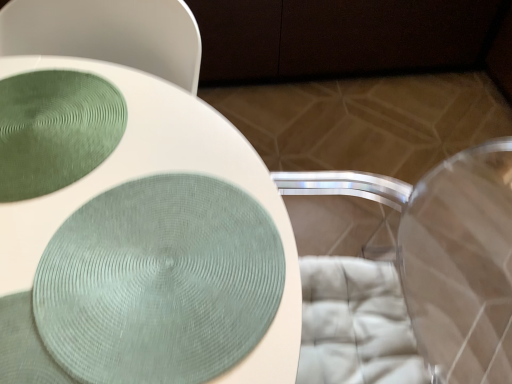
Question: Relative to transparent plastic swivel chair at lower right, is matte green fabric at center in front or behind?

Choices:
 (A) front
 (B) behind

Answer: (B)

Question: From a real-world perspective, relative to transparent plastic swivel chair at lower right, is matte green fabric at center vertically above or below?

Choices:
 (A) below
 (B) above

Answer: (A)

Question: Which object is the closest to the matte green fabric at center?

Choices:
 (A) green textured glass plate at upper left
 (B) transparent plastic swivel chair at lower right

Answer: (A)

Question: Based on their relative distances, which object is farther from the green textured glass plate at upper left?

Choices:
 (A) transparent plastic swivel chair at lower right
 (B) matte green fabric at center

Answer: (A)